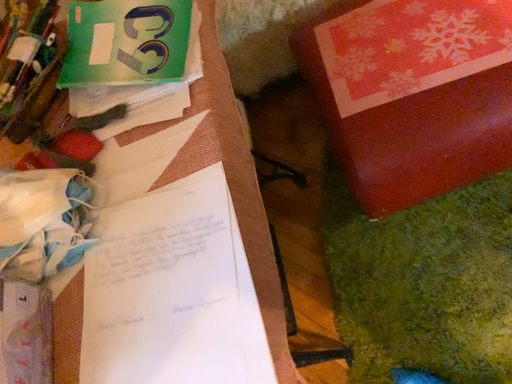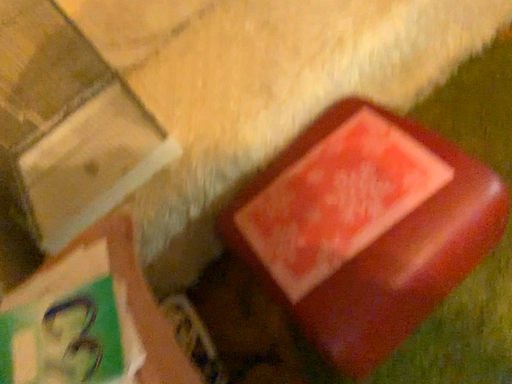
Question: Which way did the camera rotate in the video?

Choices:
 (A) rotated upward
 (B) rotated downward

Answer: (A)